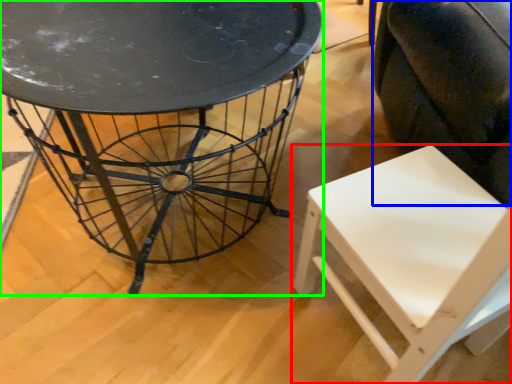
Question: Which object is positioned closest to chair (highlighted by a red box)? Select from swivel chair (highlighted by a blue box) and table (highlighted by a green box).

Choices:
 (A) swivel chair
 (B) table

Answer: (A)